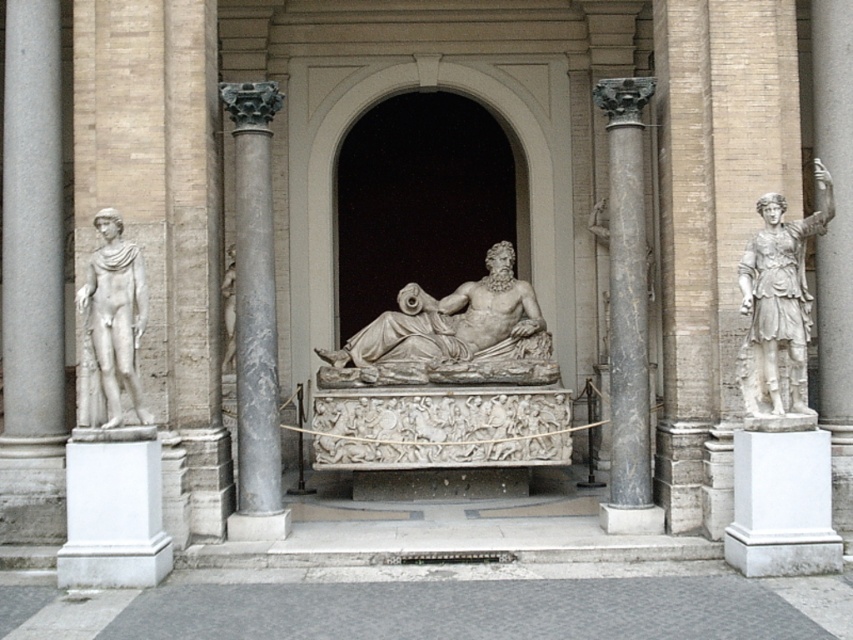
Question: Which object is positioned closest to the gray marble column at center?

Choices:
 (A) black marble column at right
 (B) white marble statue at left

Answer: (B)

Question: Based on their relative distances, which object is nearer to the white marble statue at left?

Choices:
 (A) white marble reclining figure at center
 (B) white marble statue at right
 (C) gray marble column at left

Answer: (C)

Question: Among these points, which one is nearest to the camera?

Choices:
 (A) (606, 131)
 (B) (61, 202)
 (C) (445, 320)
 (D) (97, 272)

Answer: (D)

Question: Is white marble statue at right closer to camera compared to white marble statue at left?

Choices:
 (A) yes
 (B) no

Answer: (B)

Question: Does gray marble column at center appear under white marble statue at left?

Choices:
 (A) no
 (B) yes

Answer: (A)

Question: In this image, where is gray marble column at left located relative to gray marble column at center?

Choices:
 (A) right
 (B) left

Answer: (B)